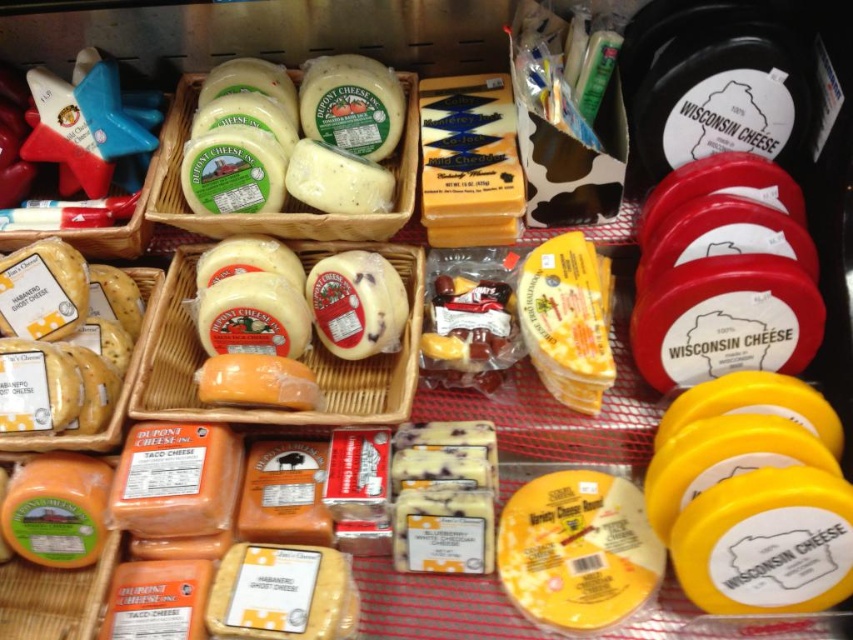
Question: Where is yellow matte variety cheese round at center located in relation to white creamy cheese at center in the image?

Choices:
 (A) left
 (B) right

Answer: (B)

Question: Is white paperboard cheese at center to the right of white creamy cheese at center from the viewer's perspective?

Choices:
 (A) no
 (B) yes

Answer: (A)

Question: Which of the following is the closest to the observer?

Choices:
 (A) (567, 589)
 (B) (6, 445)
 (C) (292, 148)
 (D) (589, 396)

Answer: (A)

Question: Which object appears farthest from the camera in this image?

Choices:
 (A) white paperboard cheese at center
 (B) matte plastic cheese at center
 (C) white creamy cheese at center

Answer: (C)

Question: Among these objects, which one is nearest to the camera?

Choices:
 (A) yellow cheese at left
 (B) matte plastic cheese at center
 (C) yellow wax cheese at center
 (D) white paperboard cheese at center

Answer: (A)

Question: In this image, where is yellow matte variety cheese round at center located relative to yellow wax cheese at center?

Choices:
 (A) left
 (B) right

Answer: (A)